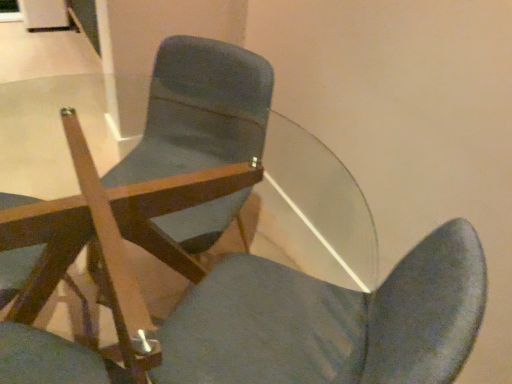
Question: Looking at the image, does matte wood chair at center, which is the 1th chair from right to left, seem bigger or smaller compared to transparent glass door at upper center?

Choices:
 (A) small
 (B) big

Answer: (B)

Question: Considering the positions of matte wood chair at center, the third chair viewed from the left, and transparent glass door at upper center in the image, is matte wood chair at center, the third chair viewed from the left, wider or thinner than transparent glass door at upper center?

Choices:
 (A) thin
 (B) wide

Answer: (B)

Question: Considering the real-world distances, which object is closest to the transparent glass door at upper center?

Choices:
 (A) matte wood chair at center, the third chair viewed from the left
 (B) matte wood chair at center, arranged as the second chair when viewed from the right
 (C) wooden chair at center, which is the 1th chair from left to right

Answer: (A)

Question: Based on their relative distances, which object is farther from the wooden chair at center, which appears as the third chair when viewed from the right?

Choices:
 (A) matte wood chair at center, the third chair viewed from the left
 (B) matte wood chair at center, arranged as the second chair when viewed from the left
 (C) transparent glass door at upper center

Answer: (C)